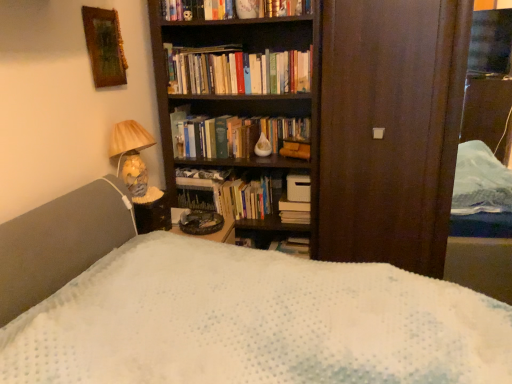
Question: Is hardcover book at center, the second book positioned from the top, to the left of wooden picture frame at upper left from the viewer's perspective?

Choices:
 (A) yes
 (B) no

Answer: (B)

Question: Is hardcover book at center, placed as the first book when sorted from back to front, bigger than wooden picture frame at upper left?

Choices:
 (A) no
 (B) yes

Answer: (B)

Question: Considering the relative sizes of hardcover book at center, placed as the first book when sorted from back to front, and wooden picture frame at upper left in the image provided, is hardcover book at center, placed as the first book when sorted from back to front, smaller than wooden picture frame at upper left?

Choices:
 (A) no
 (B) yes

Answer: (A)

Question: Is hardcover book at center, positioned as the second book in front-to-back order, shorter than wooden picture frame at upper left?

Choices:
 (A) no
 (B) yes

Answer: (B)

Question: From the image's perspective, is hardcover book at center, which is counted as the 1th book, starting from the bottom, below wooden picture frame at upper left?

Choices:
 (A) no
 (B) yes

Answer: (B)

Question: Considering the positions of hardcover books at upper center, the 2th book positioned from the back, and hardcover book at center, positioned as the second book in front-to-back order, in the image, is hardcover books at upper center, the 2th book positioned from the back, wider or thinner than hardcover book at center, positioned as the second book in front-to-back order,?

Choices:
 (A) thin
 (B) wide

Answer: (A)

Question: In the image, is hardcover books at upper center, which is the first book in front-to-back order, on the left side or the right side of hardcover book at center, placed as the first book when sorted from back to front?

Choices:
 (A) left
 (B) right

Answer: (B)

Question: From a real-world perspective, is hardcover books at upper center, the 2th book positioned from the back, positioned above or below hardcover book at center, placed as the first book when sorted from back to front?

Choices:
 (A) above
 (B) below

Answer: (A)

Question: Is hardcover books at upper center, which is the first book in front-to-back order, inside or outside of hardcover book at center, positioned as the second book in front-to-back order?

Choices:
 (A) inside
 (B) outside

Answer: (B)

Question: In the image, is hardcover book at center positioned in front of or behind wooden picture frame at upper left?

Choices:
 (A) behind
 (B) front

Answer: (A)

Question: In terms of height, does hardcover book at center look taller or shorter compared to wooden picture frame at upper left?

Choices:
 (A) tall
 (B) short

Answer: (B)

Question: Considering the positions of hardcover book at center and wooden picture frame at upper left in the image, is hardcover book at center bigger or smaller than wooden picture frame at upper left?

Choices:
 (A) big
 (B) small

Answer: (B)

Question: Looking at their shapes, would you say hardcover book at center is wider or thinner than wooden picture frame at upper left?

Choices:
 (A) wide
 (B) thin

Answer: (A)

Question: Considering the positions of matte ceramic lamp at left and hardcover books at upper center, which is the first book in front-to-back order, in the image, is matte ceramic lamp at left bigger or smaller than hardcover books at upper center, which is the first book in front-to-back order,?

Choices:
 (A) big
 (B) small

Answer: (A)

Question: In terms of height, does matte ceramic lamp at left look taller or shorter compared to hardcover books at upper center, marked as the second book in a bottom-to-top arrangement?

Choices:
 (A) tall
 (B) short

Answer: (A)